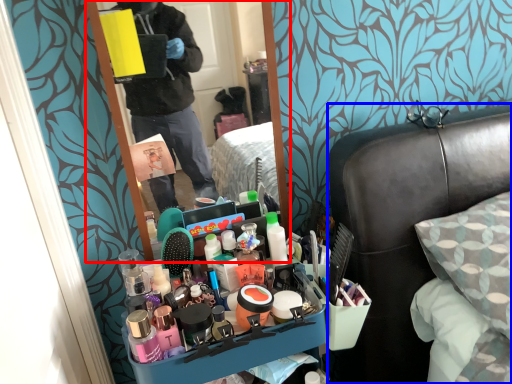
Question: Which object appears closest to the camera in this image, mirror (highlighted by a red box) or furniture (highlighted by a blue box)?

Choices:
 (A) mirror
 (B) furniture

Answer: (B)